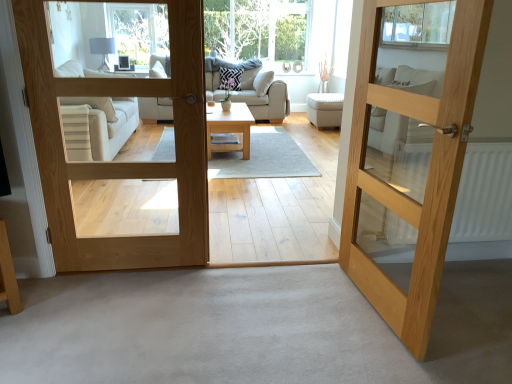
Question: Choose the correct answer: Is white textured radiator at right inside natural wood door at center, the first door viewed from the right, or outside it?

Choices:
 (A) outside
 (B) inside

Answer: (A)

Question: Does point (413, 233) appear closer or farther from the camera than point (428, 16)?

Choices:
 (A) farther
 (B) closer

Answer: (A)

Question: Estimate the real-world distances between objects in this image. Which object is closer to the beige fabric studio couch at center?

Choices:
 (A) natural wood door at center, which is the 2th door in left-to-right order
 (B) white fabric ottoman at center
 (C) natural wood door at center, marked as the second door in a right-to-left arrangement
 (D) white textured radiator at right
 (E) light wood coffee table at center

Answer: (E)

Question: Which object is the closest to the white fabric ottoman at center?

Choices:
 (A) clear glass window at upper center
 (B) white textured radiator at right
 (C) natural wood door at center, marked as the 1th door in a left-to-right arrangement
 (D) beige fabric studio couch at center
 (E) light wood coffee table at center

Answer: (D)